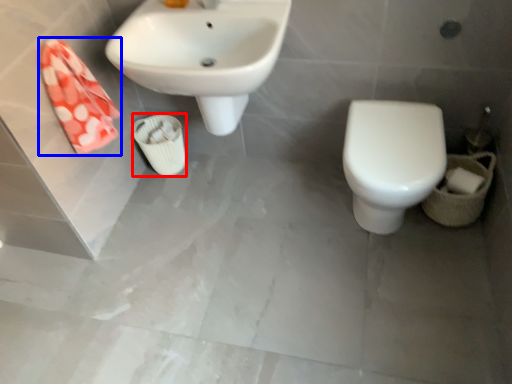
Question: Which point is closer to the camera, porcelain (highlighted by a red box) or hand towel (highlighted by a blue box)?

Choices:
 (A) porcelain
 (B) hand towel

Answer: (B)